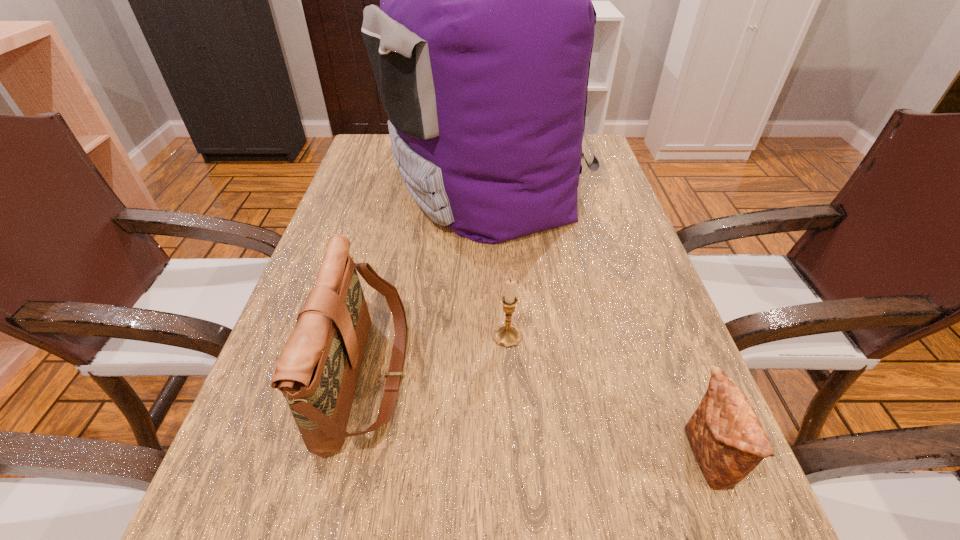
Where is `backpack`? This screenshot has height=540, width=960. backpack is located at coordinates (481, 47).

This screenshot has width=960, height=540. I want to click on the tallest object, so click(x=481, y=47).

At what (x,y) coordinates should I click in order to perform the action: click on the third shortest object. Please return your answer as a coordinate pair (x, y). The width and height of the screenshot is (960, 540). Looking at the image, I should click on (317, 372).

Image resolution: width=960 pixels, height=540 pixels. Find the location of `candle holder`. candle holder is located at coordinates (506, 335).

Locate an element on the screen. The width and height of the screenshot is (960, 540). clutch bag is located at coordinates (728, 441).

At what (x,y) coordinates should I click in order to perform the action: click on vacant area located 0.090m on the front pocket of the backpack. Please return your answer as a coordinate pair (x, y). Looking at the image, I should click on (349, 184).

The image size is (960, 540). I want to click on vacant space located 0.090m on the front-facing side of the shoulder bag, so click(x=457, y=376).

In order to click on free region located 0.190m on the back of the candle holder in this screenshot , I will do `click(503, 259)`.

Image resolution: width=960 pixels, height=540 pixels. I want to click on free space located 0.350m on the open side of the clutch bag, so click(446, 459).

Where is `free location located on the open side of the clutch bag`? free location located on the open side of the clutch bag is located at coordinates (487, 459).